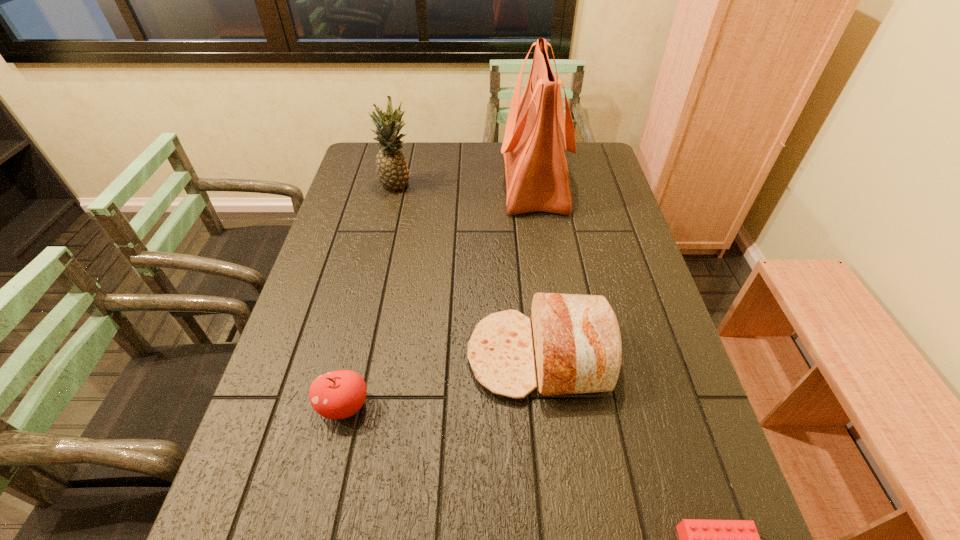
Find the location of `shopping bag`. shopping bag is located at coordinates (537, 132).

I want to click on pineapple, so click(x=393, y=174).

The image size is (960, 540). In order to click on bread in this screenshot , I will do `click(577, 343)`.

Identify the location of apple. (340, 394).

This screenshot has width=960, height=540. In order to click on vacant area located on the front pocket of the tallest object in this screenshot , I will do `click(465, 180)`.

Where is `free space located on the front pocket of the tallest object`? The width and height of the screenshot is (960, 540). free space located on the front pocket of the tallest object is located at coordinates coord(420,180).

Identify the location of vacant space positioned on the front pocket of the tallest object. (442, 180).

This screenshot has height=540, width=960. What are the coordinates of `blank space located 0.390m on the right of the fourth shortest object` in the screenshot? It's located at (529, 187).

I want to click on blank area located at the sliced end of the bread, so click(335, 356).

Locate an element on the screen. free space located 0.320m at the sliced end of the bread is located at coordinates (331, 356).